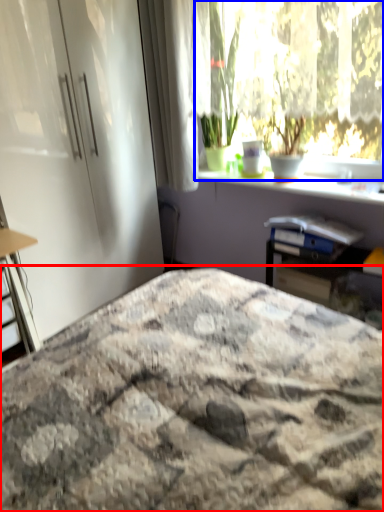
Question: Which of the following is the farthest to the observer, bed (highlighted by a red box) or window (highlighted by a blue box)?

Choices:
 (A) bed
 (B) window

Answer: (B)